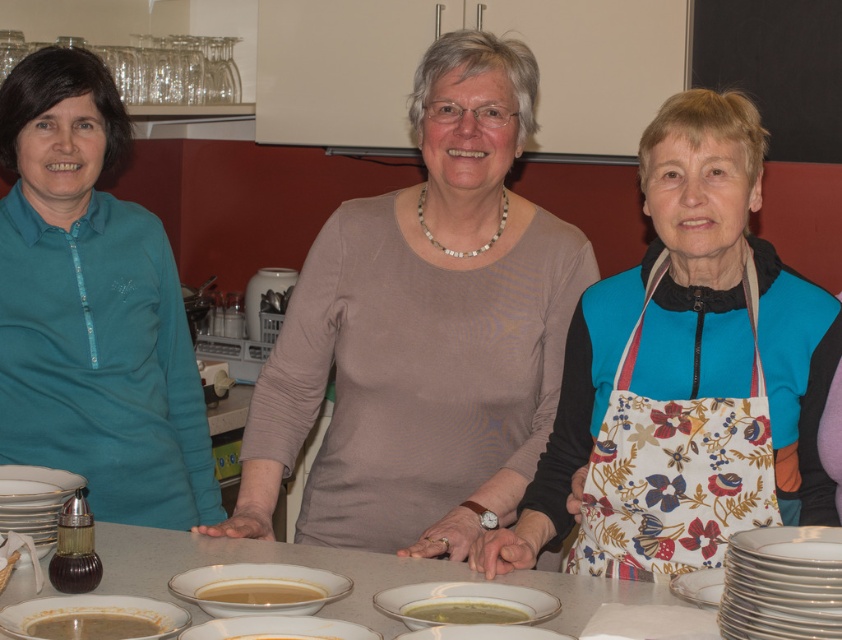
You are standing at the point with coordinates point (693, 573) and want to move to the point with coordinates point (515, 474). Which direction should you move?

You should move forward because point (515, 474) is behind point (693, 573), meaning it is in the direction you are facing.

You are a chef preparing a dish and need to place a plate on the table. The floral apron at center and the green creamy soup at center are already on the table. Which object takes up more space horizontally on the table?

The floral apron at center takes up more space horizontally on the table than the green creamy soup at center because the floral apron at center is wider than the green creamy soup at center.